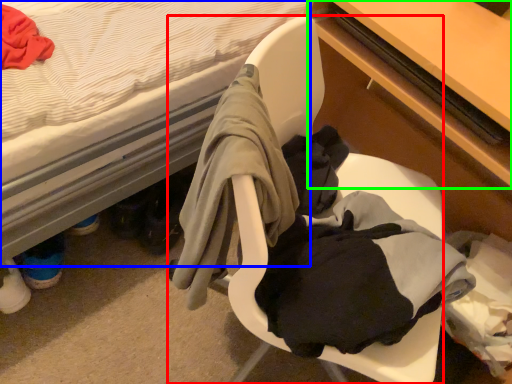
Question: Which object is the closest to the chair (highlighted by a red box)? Choose among these: bed (highlighted by a blue box) or table (highlighted by a green box).

Choices:
 (A) bed
 (B) table

Answer: (B)